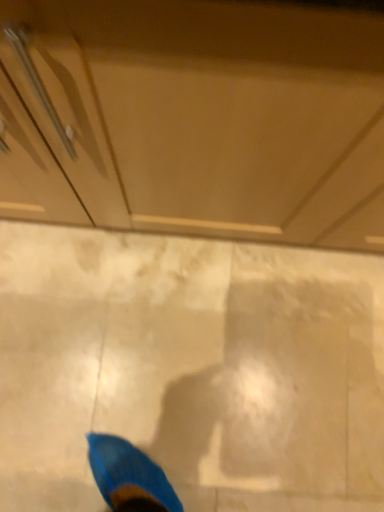
What do you see at coordinates (190, 369) in the screenshot? This screenshot has height=512, width=384. I see `white glossy concrete at center` at bounding box center [190, 369].

I want to click on white glossy concrete at center, so click(190, 369).

Locate an element on the screen. The image size is (384, 512). white glossy concrete at center is located at coordinates [190, 369].